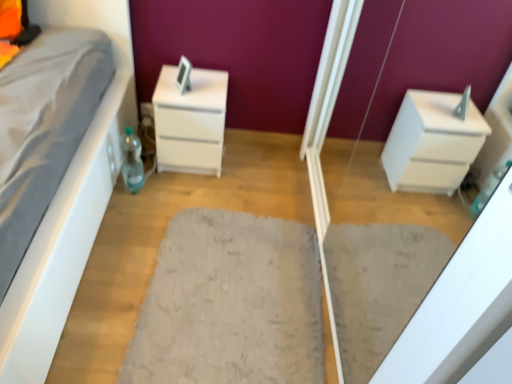
Find the location of a particular element. The image size is (512, 384). free space in front of translucent plastic bottle at lower left is located at coordinates (128, 213).